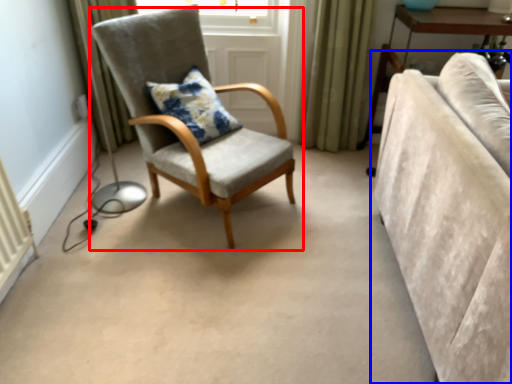
Question: Which of the following is the farthest to the observer, chair (highlighted by a red box) or studio couch (highlighted by a blue box)?

Choices:
 (A) chair
 (B) studio couch

Answer: (A)